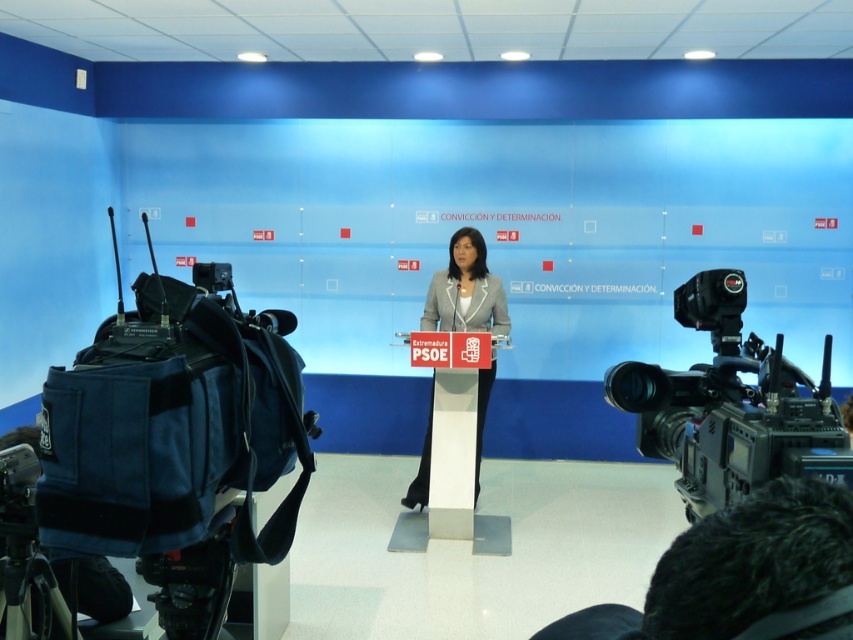
You are attending a press conference and notice two items in the front area. The dark hair at lower right and the black fabric tripod at lower left. Which one is closer to the speaker?

The dark hair at lower right is closer to the speaker because it is in front of the black fabric tripod at lower left.

You are a photographer standing at the front of the press conference room. You need to position yourself so that you can capture both the speaker at the podium and the blue fabric video camera at left in the same frame. Given that your camera has a 50mm lens, which has a standard field of view, can you estimate if you can fit both subjects into the frame without moving closer or farther away?

The blue fabric video camera at left is 1.44 meters away from the viewer. Since the photographer is already at the front, the distance to the podium and speaker is likely similar. A 50mm lens on a full frame camera has a diagonal field of view of approximately 46 degrees. At 1.44 meters, this would allow capturing objects within a roughly 1.1 meter width at that distance. The podium and speaker are central, while the camera is on the left. The spatial arrangement suggests both can fit within the 1.1 meter 5